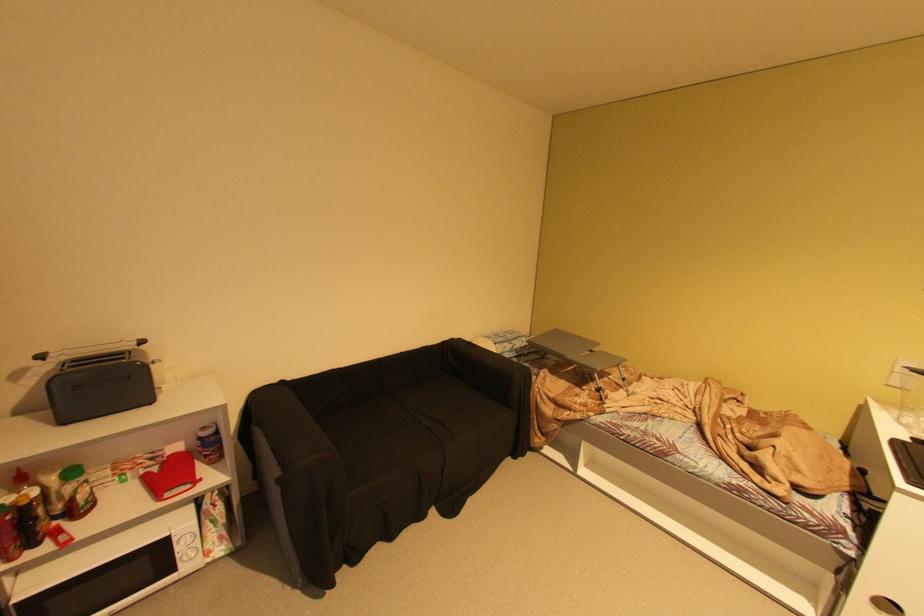
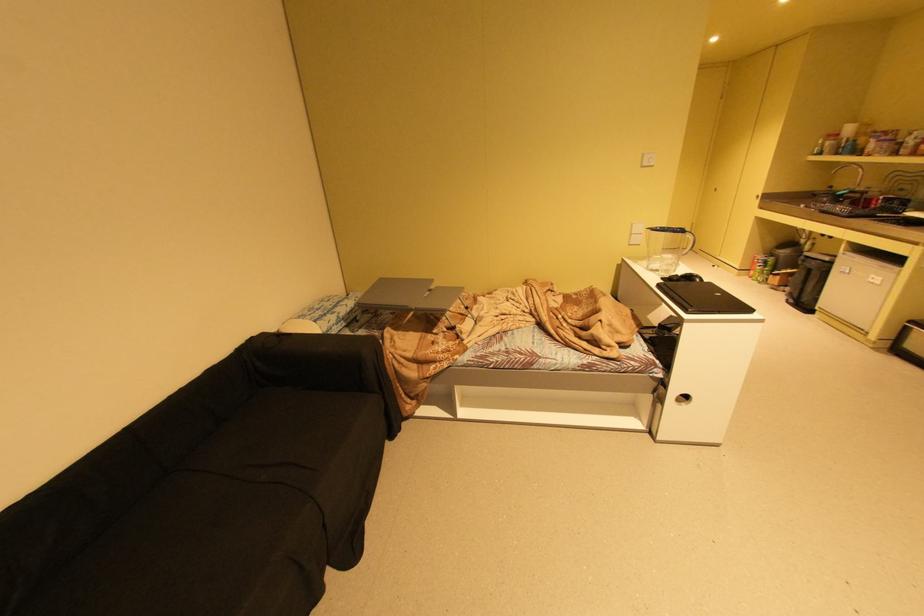
Question: The first image is from the beginning of the video and the second image is from the end. How did the camera likely rotate when shooting the video?

Choices:
 (A) Left
 (B) Right
 (C) Up
 (D) Down

Answer: (B)